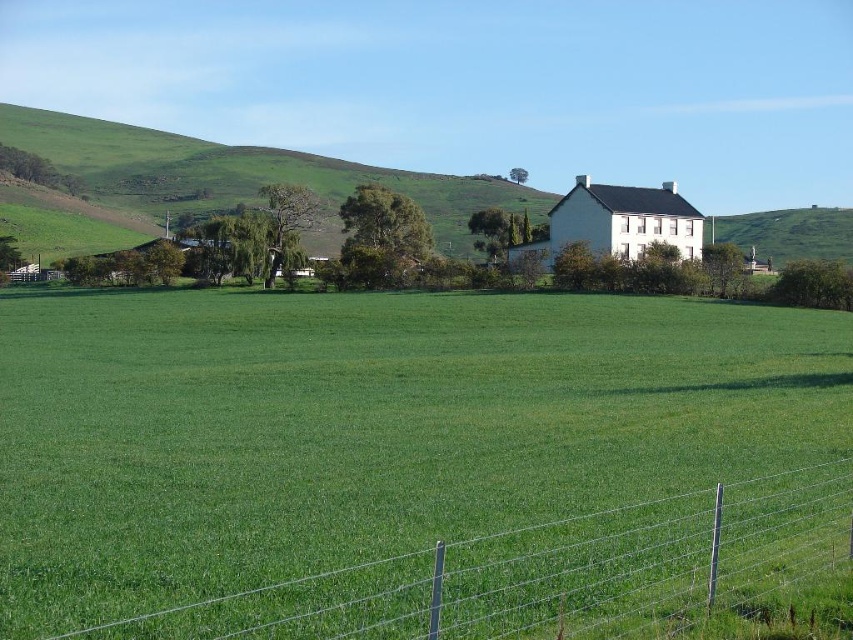
Question: Is green grass field at center above wire mesh fence at lower right?

Choices:
 (A) no
 (B) yes

Answer: (B)

Question: Considering the real-world distances, which object is closest to the green grassy hillside at upper left?

Choices:
 (A) green grass field at center
 (B) wire mesh fence at lower right

Answer: (A)

Question: Is green grass field at center wider than wire mesh fence at lower right?

Choices:
 (A) yes
 (B) no

Answer: (A)

Question: Which point is closer to the camera taking this photo?

Choices:
 (A) (184, 627)
 (B) (42, 129)
 (C) (582, 323)

Answer: (A)

Question: Which of the following is the closest to the observer?

Choices:
 (A) green grass field at center
 (B) green grassy hillside at upper left

Answer: (A)

Question: In this image, where is wire mesh fence at lower right located relative to green grassy hillside at upper left?

Choices:
 (A) right
 (B) left

Answer: (A)